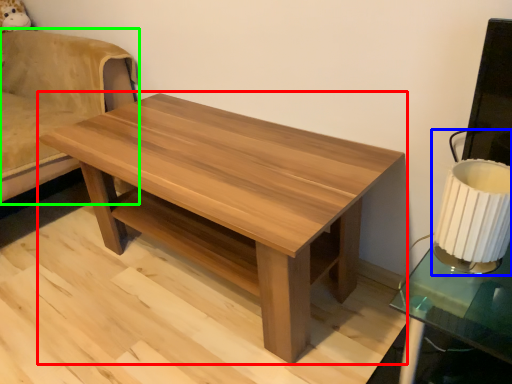
Question: Which object is positioned closest to coffee table (highlighted by a red box)? Select from table lamp (highlighted by a blue box) and swivel chair (highlighted by a green box).

Choices:
 (A) table lamp
 (B) swivel chair

Answer: (A)